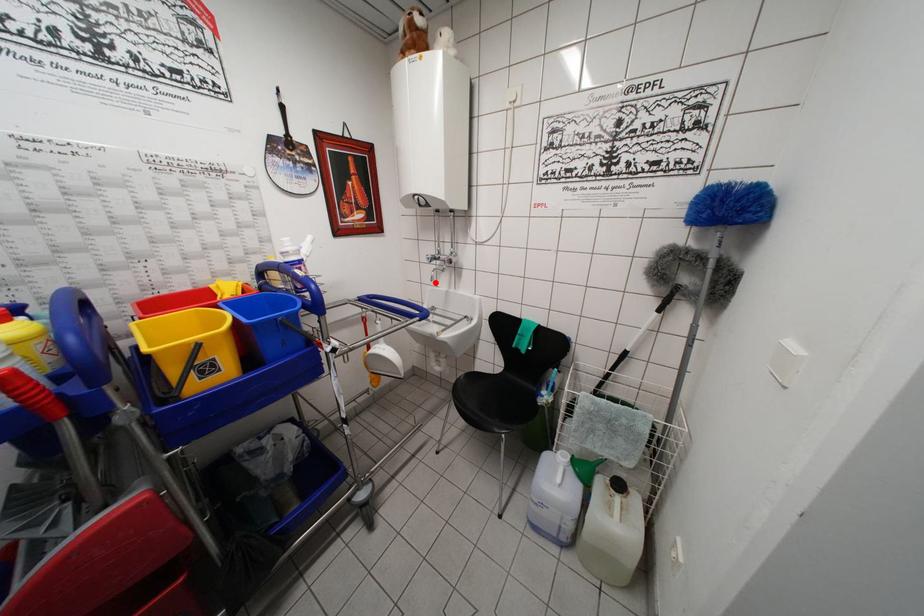
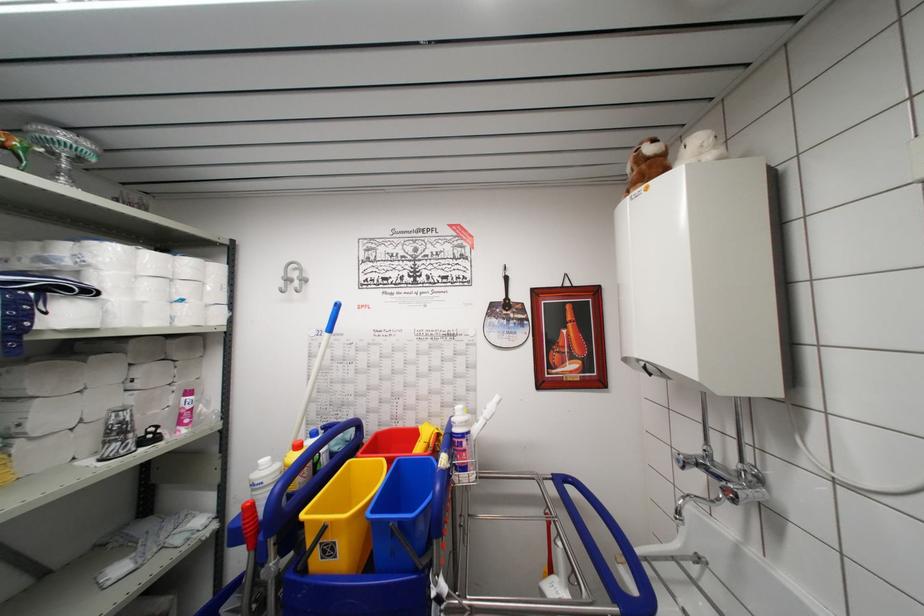
Find the pixel in the second image that matches the highlighted location in the first image.

(681, 517)